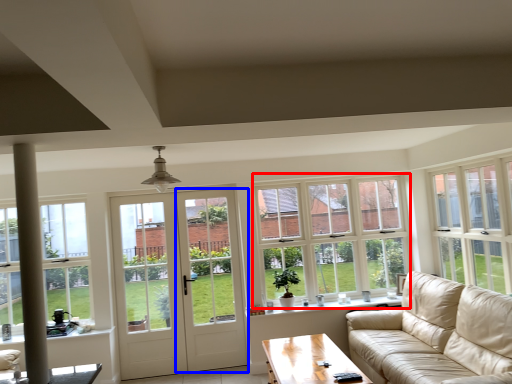
Question: Which object is closer to the camera taking this photo, window (highlighted by a red box) or screen door (highlighted by a blue box)?

Choices:
 (A) window
 (B) screen door

Answer: (B)